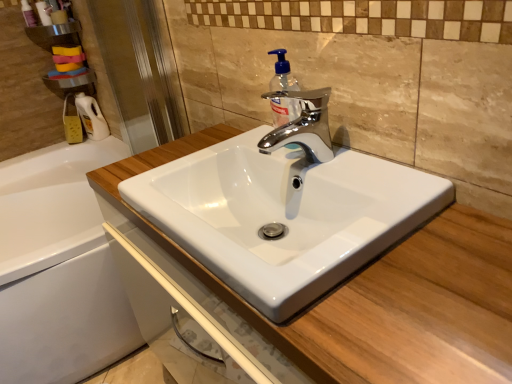
What are the coordinates of `blank space to the left of transparent plastic soap dispenser at center` in the screenshot? It's located at (240, 148).